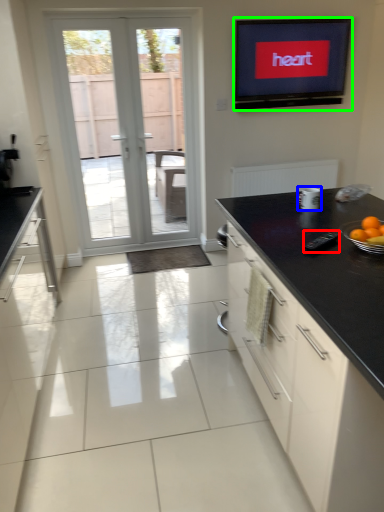
Question: Which object is the farthest from appliance (highlighted by a red box)? Choose among these: appliance (highlighted by a blue box) or electronic (highlighted by a green box).

Choices:
 (A) appliance
 (B) electronic

Answer: (B)